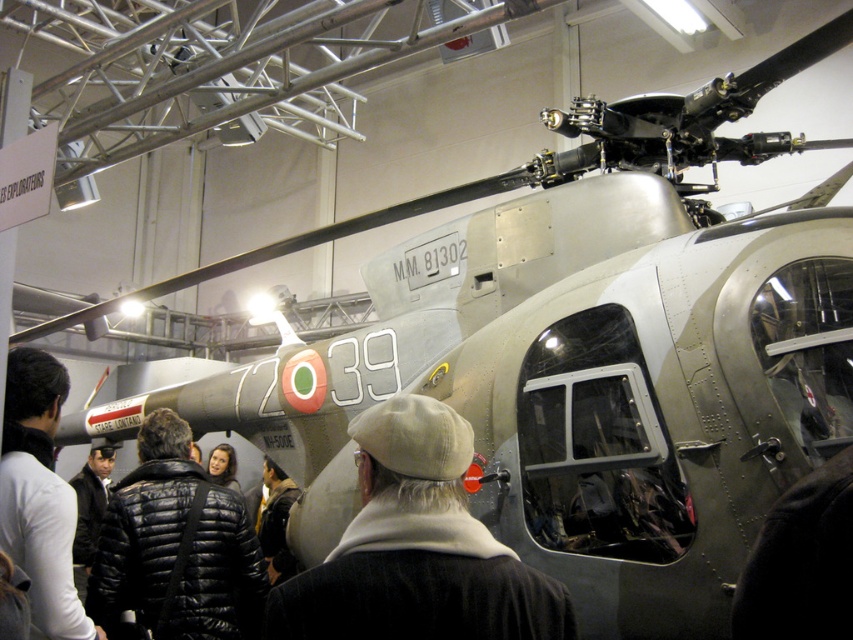
You are a security guard in the museum and you see the black quilted jacket at lower left. Where is the black quilted jacket located in the image?

The black quilted jacket at lower left is located at point [39,493] in the image.

You are a security guard in the exhibition hall and need to determine if both the black quilted jacket at lower left and the black jacket at center can fit on a security booth shelf that is 1 meter wide. Which jacket takes up less space horizontally?

The black quilted jacket at lower left has a smaller width than the black jacket at center, so it takes up less horizontal space.

You are standing in the exhibition hall and see the black quilted jacket at lower left. If you want to reach it without moving your feet, can you do so with your outstretched arm?

The black quilted jacket at lower left is 7.55 feet away from the viewer. Since the average human arm span is about 6 feet, you cannot reach it without moving your feet.